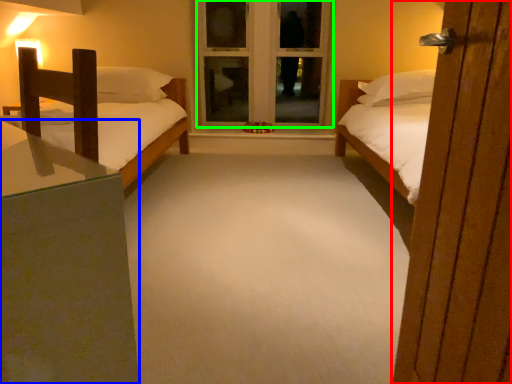
Question: Considering the real-world distances, which object is farthest from door (highlighted by a red box)? nightstand (highlighted by a blue box) or window frame (highlighted by a green box)?

Choices:
 (A) nightstand
 (B) window frame

Answer: (B)